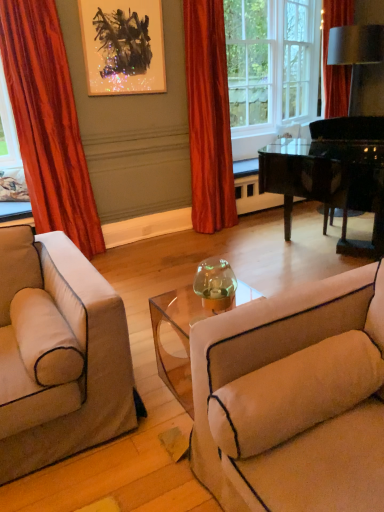
At what (x,y) coordinates should I click in order to perform the action: click on free space to the right of silky orange curtain at center, which is the 1th curtain from right to left. Please return your answer as a coordinate pair (x, y). Image resolution: width=384 pixels, height=512 pixels. Looking at the image, I should click on (x=251, y=229).